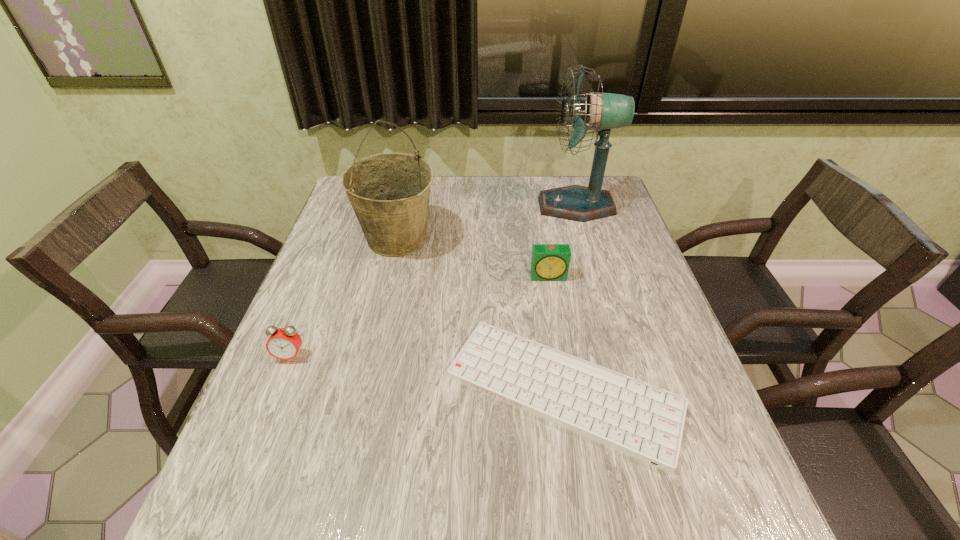
Find the location of a particular element. This screenshot has width=960, height=540. free region that satisfies the following two spatial constraints: 1. in front of the fan where the wind blows; 2. on the front-facing side of the third farthest object is located at coordinates (597, 276).

Locate an element on the screen. The width and height of the screenshot is (960, 540). free space that satisfies the following two spatial constraints: 1. in front of the tallest object where the wind blows; 2. on the front-facing side of the leftmost object is located at coordinates (620, 356).

Image resolution: width=960 pixels, height=540 pixels. What are the coordinates of `free point that satisfies the following two spatial constraints: 1. in front of the fan where the wind blows; 2. on the front side of the second object from left to right` in the screenshot? It's located at (586, 239).

Locate an element on the screen. This screenshot has height=540, width=960. blank space that satisfies the following two spatial constraints: 1. on the front side of the fourth shortest object; 2. on the left side of the computer keyboard is located at coordinates (362, 391).

At what (x,y) coordinates should I click in order to perform the action: click on free space that satisfies the following two spatial constraints: 1. in front of the tallest object where the wind blows; 2. on the front-facing side of the third nearest object. Please return your answer as a coordinate pair (x, y). Looking at the image, I should click on (597, 276).

Identify the location of blank area in the image that satisfies the following two spatial constraints: 1. in front of the tallest object where the wind blows; 2. on the front-facing side of the third nearest object. The width and height of the screenshot is (960, 540). (597, 276).